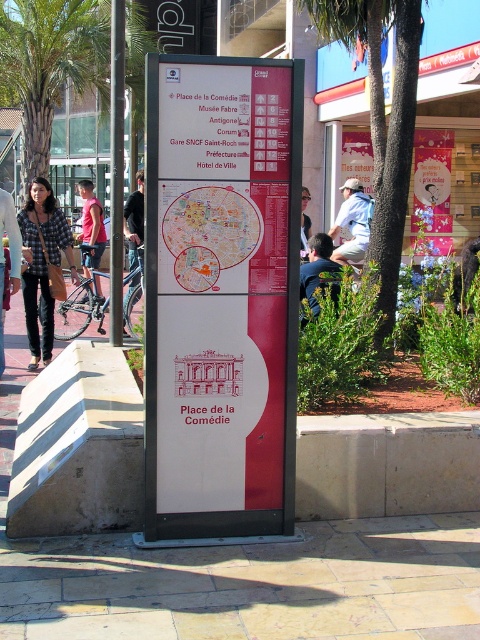
Question: Considering the relative positions of light beige stone pavement at center and denim jacket at left in the image provided, where is light beige stone pavement at center located with respect to denim jacket at left?

Choices:
 (A) above
 (B) below

Answer: (B)

Question: Which object is farther from the camera taking this photo?

Choices:
 (A) black fabric jacket at left
 (B) brushed metal pole at center
 (C) denim jacket at left
 (D) matte red sign at center

Answer: (A)

Question: Which object appears closest to the camera in this image?

Choices:
 (A) denim jacket at left
 (B) dark blue shirt at center
 (C) checkered fabric shirt at left
 (D) light blue denim jeans at center

Answer: (D)

Question: Among these objects, which one is nearest to the camera?

Choices:
 (A) white cotton shirt at center
 (B) matte red sign at center

Answer: (B)

Question: Is checkered fabric shirt at left thinner than brushed metal pole at center?

Choices:
 (A) no
 (B) yes

Answer: (A)

Question: Does white cotton shirt at center have a greater width compared to light blue denim jeans at center?

Choices:
 (A) no
 (B) yes

Answer: (A)